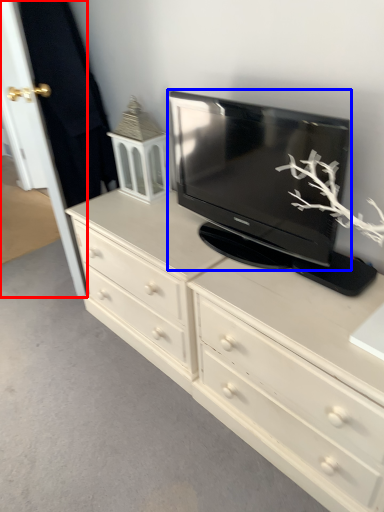
Question: Which object is closer to the camera taking this photo, door (highlighted by a red box) or television (highlighted by a blue box)?

Choices:
 (A) door
 (B) television

Answer: (B)